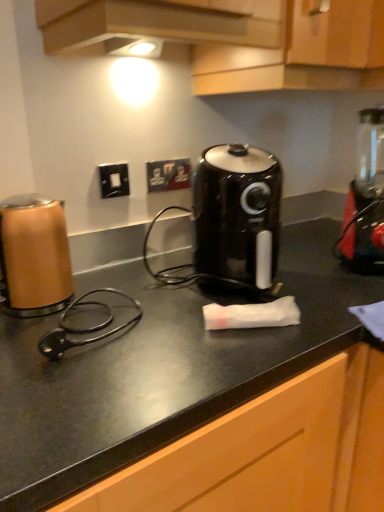
Identify the location of vacant region in front of black plastic air fryer at center. The width and height of the screenshot is (384, 512). (272, 344).